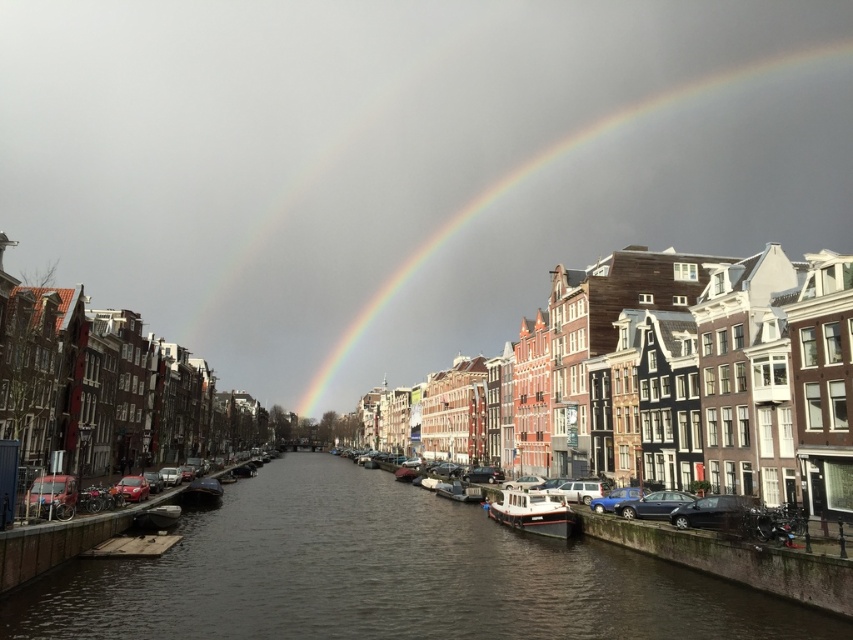
You are a tourist standing on the right side of the canal. You want to take a photo of the white glossy boat at center and the wooden boat at center. Which boat will appear taller in your photo?

The white glossy boat at center will appear taller in the photo because it has a greater height compared to the wooden boat at center.

You are standing at the point marked by the coordinates point (509, 506) in the canal scene. A tour boat is approaching from the direction of the red van parked on the left. If the boat maintains a constant speed of 10 meters per minute, how many minutes will it take for the boat to reach your location?

The distance between the point (509, 506) and the viewer is 98.98 meters. Since the boat is moving at 10 meters per minute, it will take approximately 9.9 minutes to reach the location marked by point (509, 506).

You are planning to take a boat tour on the canal and have two options available for your group of six people. The white glossy boat at center and the smooth wooden boat at center are both docked at the same location. Based on their sizes, which boat would you recommend for your group to ensure comfort?

The white glossy boat at center is larger in size than the smooth wooden boat at center, so it would be more comfortable for a group of six people.